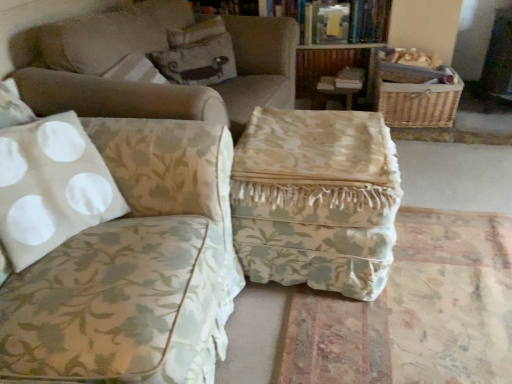
Locate an element on the screen. floral fabric ottoman at center is located at coordinates (316, 199).

At what (x,y) coordinates should I click in order to perform the action: click on hardcover book at upper center. Please return your answer as a coordinate pair (x, y). The height and width of the screenshot is (384, 512). Looking at the image, I should click on (333, 19).

Measure the distance between floral fabric ottoman at center, which is the first studio couch from back to front, and camera.

A distance of 5.05 feet exists between floral fabric ottoman at center, which is the first studio couch from back to front, and camera.

What do you see at coordinates (149, 53) in the screenshot?
I see `floral fabric ottoman at center, which is counted as the second studio couch, starting from the front` at bounding box center [149, 53].

Image resolution: width=512 pixels, height=384 pixels. What do you see at coordinates (418, 103) in the screenshot? I see `woven brown basket at upper right` at bounding box center [418, 103].

Identify the location of floral fabric ottoman at center. (412, 310).

Describe the element at coordinates (116, 249) in the screenshot. I see `white fabric studio couch at left, the second studio couch viewed from the back` at that location.

This screenshot has width=512, height=384. I want to click on floral fabric ottoman at center, so click(316, 199).

Between hardcover book at upper center and floral fabric ottoman at center, which is counted as the second studio couch, starting from the front, which one has more height?

With more height is floral fabric ottoman at center, which is counted as the second studio couch, starting from the front.

Looking at this image, is hardcover book at upper center to the left or to the right of floral fabric ottoman at center, which is counted as the second studio couch, starting from the front, in the image?

Based on their positions, hardcover book at upper center is located to the right of floral fabric ottoman at center, which is counted as the second studio couch, starting from the front.

Is the depth of hardcover book at upper center less than that of floral fabric ottoman at center, which is the first studio couch from back to front?

No.

From the picture: From the image's perspective, which object appears higher, hardcover book at upper center or floral fabric ottoman at center, which is counted as the second studio couch, starting from the front?

From the image's view, hardcover book at upper center is above.

Between hardcover book at upper center and white fabric studio couch at left, which appears as the 1th studio couch when viewed from the front, which one appears on the right side from the viewer's perspective?

Positioned to the right is hardcover book at upper center.

Are hardcover book at upper center and white fabric studio couch at left, the second studio couch viewed from the back, located far from each other?

Indeed, hardcover book at upper center is not near white fabric studio couch at left, the second studio couch viewed from the back.

Is hardcover book at upper center in front of or behind white fabric studio couch at left, the second studio couch viewed from the back, in the image?

Clearly, hardcover book at upper center is behind white fabric studio couch at left, the second studio couch viewed from the back.

Considering the relative sizes of hardcover book at upper center and white fabric studio couch at left, the second studio couch viewed from the back, in the image provided, is hardcover book at upper center wider than white fabric studio couch at left, the second studio couch viewed from the back,?

No.

Is floral fabric ottoman at center, which is the first studio couch from back to front, at the right side of floral fabric ottoman at center?

No, floral fabric ottoman at center, which is the first studio couch from back to front, is not to the right of floral fabric ottoman at center.

Does floral fabric ottoman at center, which is counted as the second studio couch, starting from the front, have a greater height compared to floral fabric ottoman at center?

Yes.

Considering the relative sizes of floral fabric ottoman at center, which is the first studio couch from back to front, and floral fabric ottoman at center in the image provided, is floral fabric ottoman at center, which is the first studio couch from back to front, smaller than floral fabric ottoman at center?

Incorrect, floral fabric ottoman at center, which is the first studio couch from back to front, is not smaller in size than floral fabric ottoman at center.

Looking at this image, from a real-world perspective, which is physically below, floral fabric ottoman at center, which is counted as the second studio couch, starting from the front, or floral fabric ottoman at center?

From a 3D spatial view, floral fabric ottoman at center is below.

There is a floral fabric pillow at upper center. Where is `the 2nd studio couch below it (from the image's perspective)`? the 2nd studio couch below it (from the image's perspective) is located at coordinates (116, 249).

Do you think floral fabric pillow at upper center is within white fabric studio couch at left, the second studio couch viewed from the back, or outside of it?

The correct answer is: outside.

Considering the points (163, 72) and (89, 191), which point is in front, point (163, 72) or point (89, 191)?

Positioned in front is point (89, 191).

From the image's perspective, who appears lower, floral fabric pillow at upper center or white fabric studio couch at left, which appears as the 1th studio couch when viewed from the front?

white fabric studio couch at left, which appears as the 1th studio couch when viewed from the front, appears lower in the image.

From a real-world perspective, does floral fabric ottoman at center sit lower than floral fabric ottoman at center?

No, from a real-world perspective, floral fabric ottoman at center is not beneath floral fabric ottoman at center.

Based on the photo, is there a large distance between floral fabric ottoman at center and floral fabric ottoman at center?

floral fabric ottoman at center is near floral fabric ottoman at center, not far away.

In the scene shown: Is floral fabric ottoman at center positioned with its back to floral fabric ottoman at center?

No.

Considering the relative positions of floral fabric ottoman at center and floral fabric ottoman at center in the image provided, is floral fabric ottoman at center to the left or to the right of floral fabric ottoman at center?

floral fabric ottoman at center is to the left of floral fabric ottoman at center.

Who is smaller, floral fabric ottoman at center or hardcover book at upper center?

hardcover book at upper center.

From a real-world perspective, is floral fabric ottoman at center positioned over hardcover book at upper center based on gravity?

Actually, floral fabric ottoman at center is physically below hardcover book at upper center in the real world.

Considering the relative sizes of floral fabric ottoman at center and hardcover book at upper center in the image provided, is floral fabric ottoman at center taller than hardcover book at upper center?

Correct, floral fabric ottoman at center is much taller as hardcover book at upper center.

Which object is positioned more to the left, floral fabric ottoman at center or hardcover book at upper center?

Positioned to the left is floral fabric ottoman at center.

Considering the relative sizes of floral fabric ottoman at center and white fabric studio couch at left, which appears as the 1th studio couch when viewed from the front, in the image provided, is floral fabric ottoman at center wider than white fabric studio couch at left, which appears as the 1th studio couch when viewed from the front,?

Indeed, floral fabric ottoman at center has a greater width compared to white fabric studio couch at left, which appears as the 1th studio couch when viewed from the front.

Is white fabric studio couch at left, the second studio couch viewed from the back, a part of floral fabric ottoman at center?

Actually, white fabric studio couch at left, the second studio couch viewed from the back, is outside floral fabric ottoman at center.

Measure the distance from floral fabric ottoman at center to white fabric studio couch at left, the second studio couch viewed from the back.

A distance of 68.11 centimeters exists between floral fabric ottoman at center and white fabric studio couch at left, the second studio couch viewed from the back.

From a real-world perspective, who is located higher, floral fabric ottoman at center or white fabric studio couch at left, which appears as the 1th studio couch when viewed from the front?

white fabric studio couch at left, which appears as the 1th studio couch when viewed from the front.

This screenshot has width=512, height=384. In order to click on the 1st studio couch in front of the hardcover book at upper center, counting from the anchor's position in this screenshot , I will do `click(149, 53)`.

There is a hardcover book at upper center. At what (x,y) coordinates should I click in order to perform the action: click on the 2nd studio couch below it (from the image's perspective). Please return your answer as a coordinate pair (x, y). This screenshot has height=384, width=512. Looking at the image, I should click on (116, 249).

Estimate the real-world distances between objects in this image. Which object is further from floral fabric ottoman at center, floral fabric ottoman at center or white fabric studio couch at left, the second studio couch viewed from the back?

The object further to floral fabric ottoman at center is white fabric studio couch at left, the second studio couch viewed from the back.

Based on the photo, estimate the real-world distances between objects in this image. Which object is further from hardcover book at upper center, floral fabric pillow at upper center or floral fabric ottoman at center?

floral fabric ottoman at center lies further to hardcover book at upper center than the other object.

Looking at the image, which one is located closer to woven brown basket at upper right, floral fabric pillow at upper center or floral fabric ottoman at center, which is counted as the second studio couch, starting from the front?

Among the two, floral fabric pillow at upper center is located nearer to woven brown basket at upper right.

In the scene shown: Estimate the real-world distances between objects in this image. Which object is further from floral fabric pillow at upper center, hardcover book at upper center or floral fabric ottoman at center?

floral fabric ottoman at center is positioned further to the anchor floral fabric pillow at upper center.

Considering their positions, is floral fabric ottoman at center positioned further to woven brown basket at upper right than hardcover book at upper center?

The object further to woven brown basket at upper right is floral fabric ottoman at center.

Based on their spatial positions, is woven brown basket at upper right or floral fabric ottoman at center, which is the first studio couch from back to front, further from floral fabric pillow at upper center?

Based on the image, woven brown basket at upper right appears to be further to floral fabric pillow at upper center.

Based on their spatial positions, is hardcover book at upper center or floral fabric ottoman at center, which is counted as the second studio couch, starting from the front, further from floral fabric ottoman at center?

hardcover book at upper center lies further to floral fabric ottoman at center than the other object.

Estimate the real-world distances between objects in this image. Which object is closer to woven brown basket at upper right, floral fabric ottoman at center or hardcover book at upper center?

The object closer to woven brown basket at upper right is hardcover book at upper center.

Where is `table situated between floral fabric ottoman at center, which is counted as the second studio couch, starting from the front, and woven brown basket at upper right from left to right`? table situated between floral fabric ottoman at center, which is counted as the second studio couch, starting from the front, and woven brown basket at upper right from left to right is located at coordinates (316, 199).

Image resolution: width=512 pixels, height=384 pixels. In order to click on table between white fabric studio couch at left, the second studio couch viewed from the back, and floral fabric ottoman at center in this screenshot , I will do `click(316, 199)`.

At what (x,y) coordinates should I click in order to perform the action: click on table between floral fabric pillow at upper center and floral fabric ottoman at center vertically. Please return your answer as a coordinate pair (x, y). Looking at the image, I should click on (316, 199).

The width and height of the screenshot is (512, 384). I want to click on pillow between white fabric studio couch at left, which appears as the 1th studio couch when viewed from the front, and floral fabric ottoman at center, so click(x=197, y=60).